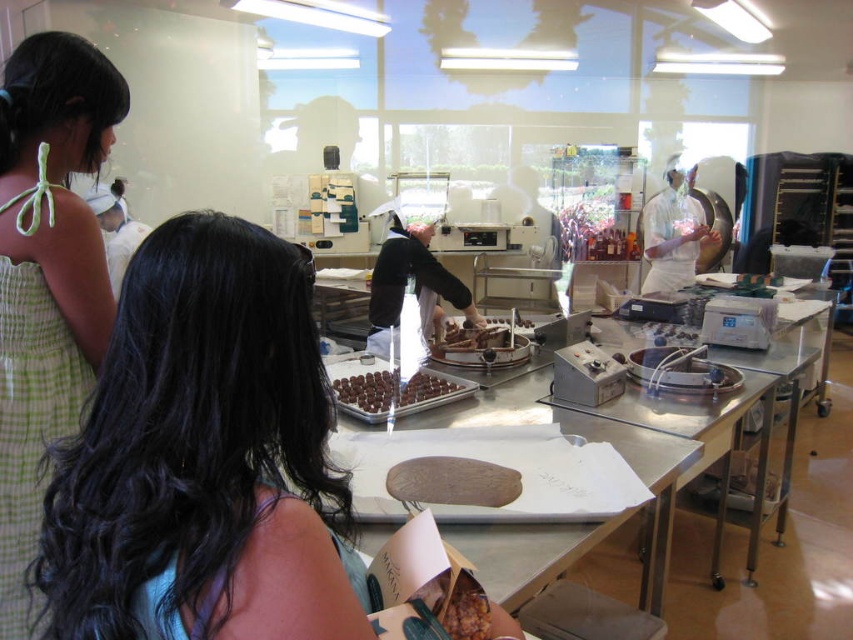
Question: Among these points, which one is nearest to the camera?

Choices:
 (A) (103, 564)
 (B) (407, 406)
 (C) (97, 237)
 (D) (474, 346)

Answer: (A)

Question: Which point is farther from the camera taking this photo?

Choices:
 (A) (521, 355)
 (B) (73, 310)
 (C) (318, 595)

Answer: (A)

Question: Is smooth black hair at center positioned at the back of green checkered dress at upper left?

Choices:
 (A) no
 (B) yes

Answer: (A)

Question: Among these objects, which one is nearest to the camera?

Choices:
 (A) chocolate matte chocolate at center
 (B) smooth black hair at center
 (C) chocolate matte truffles at center
 (D) green checkered dress at upper left

Answer: (B)

Question: Is smooth black hair at center positioned before chocolate matte chocolate at center?

Choices:
 (A) yes
 (B) no

Answer: (A)

Question: Is smooth black hair at center positioned in front of green checkered dress at upper left?

Choices:
 (A) yes
 (B) no

Answer: (A)